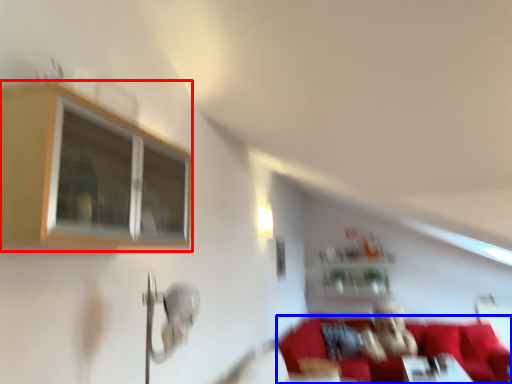
Question: Which of the following is the farthest to the observer, window (highlighted by a red box) or couch (highlighted by a blue box)?

Choices:
 (A) window
 (B) couch

Answer: (B)